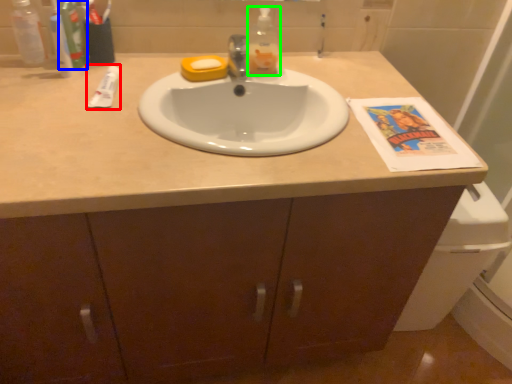
Question: Based on their relative distances, which object is nearer to toothpaste (highlighted by a red box)? Choose from toiletry (highlighted by a blue box) and bottle (highlighted by a green box).

Choices:
 (A) toiletry
 (B) bottle

Answer: (A)